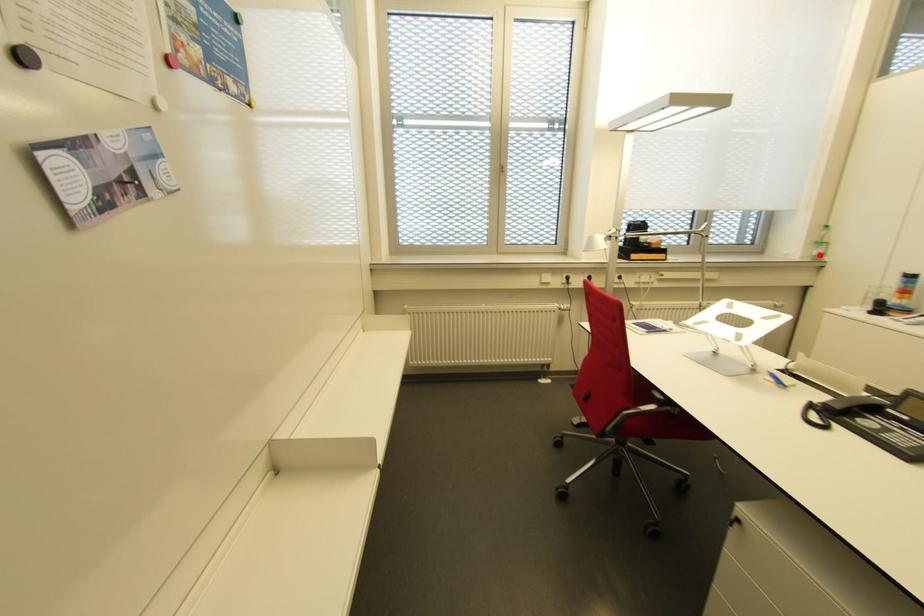
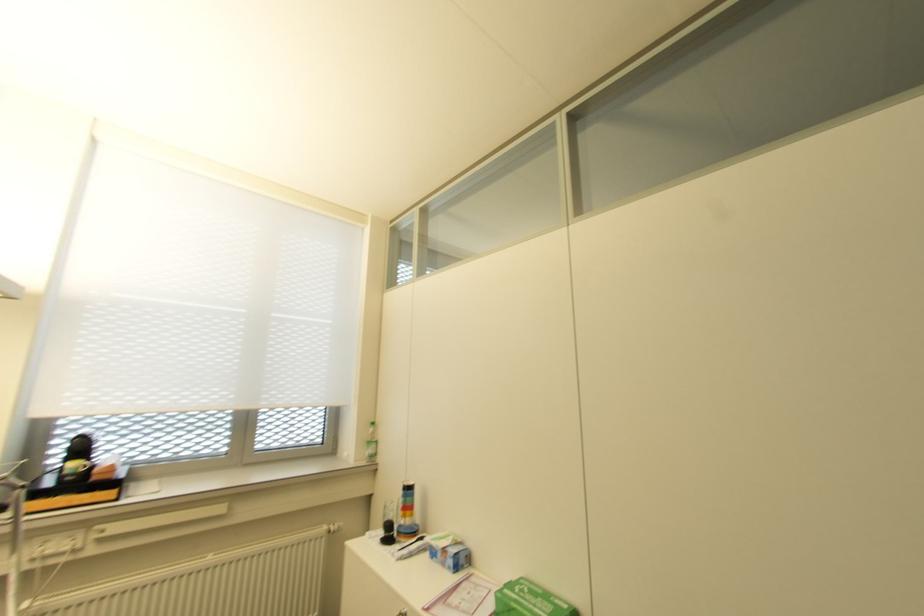
Locate, in the second image, the point that corresponds to the highlighted location in the first image.

(372, 455)